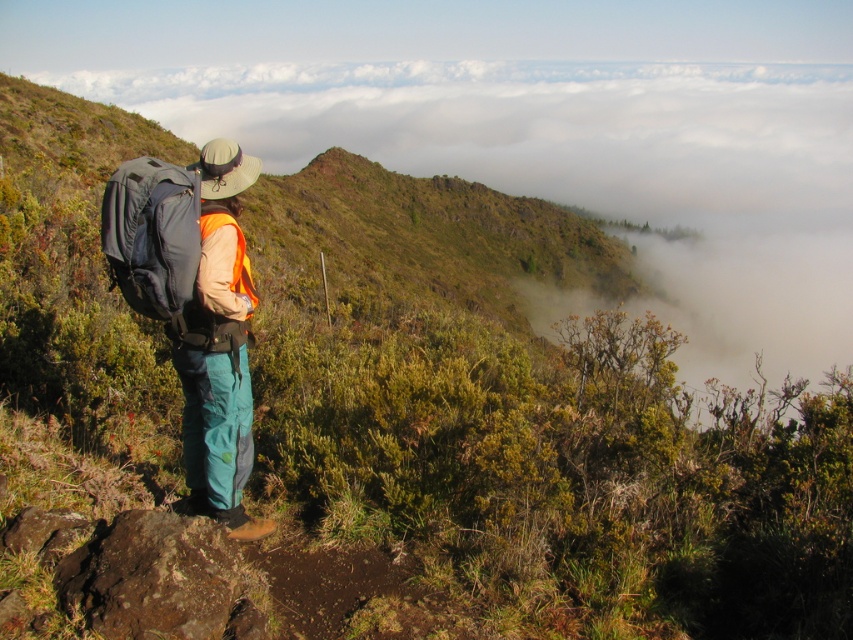
You are a hiker planning to place a small GPS device on the ground near the point marked at coordinates point (218, 348). Given the description of the terrain, what type of surface will the GPS device be placed on?

The point (218, 348) corresponds to the matte blue backpack at center, so the GPS device will be placed on the backpack, which is a solid surface.

You are a hiker who wants to take a photo of the landscape. You have two backpacks, the matte blue backpack at center and the matte black backpack at center. Which backpack should you move to ensure the other doesn t block your view?

You should move the matte black backpack at center because it is behind the matte blue backpack at center and would block the view if not moved.

You are a hiker who just arrived at the rocky outcrop and see both the matte blue backpack at center and the matte black backpack at center. Which backpack is positioned to the right side of the other?

The matte blue backpack at center is positioned to the right of the matte black backpack at center.